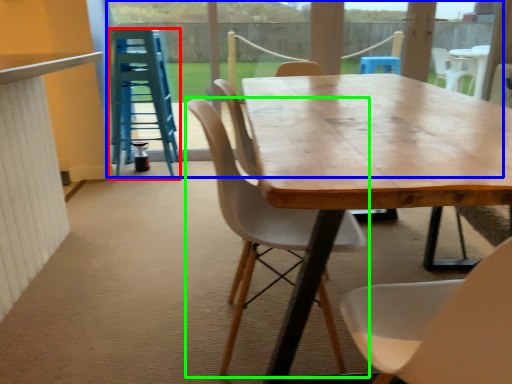
Question: Which is farther away from stool (highlighted by a red box)? glass door (highlighted by a blue box) or chair (highlighted by a green box)?

Choices:
 (A) glass door
 (B) chair

Answer: (B)